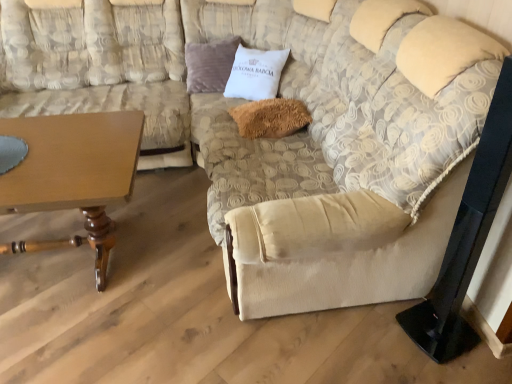
What do you see at coordinates (100, 66) in the screenshot? This screenshot has width=512, height=384. I see `beige fabric couch at left` at bounding box center [100, 66].

Where is `velvet purple pillow at upper center, arranged as the second pillow when ordered from the bottom`? Image resolution: width=512 pixels, height=384 pixels. velvet purple pillow at upper center, arranged as the second pillow when ordered from the bottom is located at coordinates (210, 64).

Locate an element on the screen. The height and width of the screenshot is (384, 512). beige fabric couch at left is located at coordinates (100, 66).

Which of these two, fuzzy brown pillow at center, the second pillow viewed from the top, or beige fabric couch at left, is wider?

Wider between the two is beige fabric couch at left.

Which of these two, fuzzy brown pillow at center, placed as the 1th pillow when sorted from front to back, or beige fabric couch at left, stands shorter?

With less height is fuzzy brown pillow at center, placed as the 1th pillow when sorted from front to back.

What's the angular difference between fuzzy brown pillow at center, which is counted as the second pillow, starting from the back, and beige fabric couch at left's facing directions?

88.8 degrees.

Considering the points (302, 119) and (24, 18), which point is behind, point (302, 119) or point (24, 18)?

Point (24, 18)

Would you say wooden table at lower left is inside or outside fuzzy brown pillow at center, placed as the 1th pillow when sorted from front to back?

wooden table at lower left cannot be found inside fuzzy brown pillow at center, placed as the 1th pillow when sorted from front to back.

What's the angular difference between wooden table at lower left and fuzzy brown pillow at center, which is counted as the second pillow, starting from the back,'s facing directions?

87.1 degrees separate the facing orientations of wooden table at lower left and fuzzy brown pillow at center, which is counted as the second pillow, starting from the back.

In the scene shown: Is wooden table at lower left wider than fuzzy brown pillow at center, which is the first pillow in right-to-left order?

Yes, wooden table at lower left is wider than fuzzy brown pillow at center, which is the first pillow in right-to-left order.

Looking at this image, considering the relative sizes of wooden table at lower left and fuzzy brown pillow at center, which is counted as the second pillow, starting from the back, in the image provided, is wooden table at lower left bigger than fuzzy brown pillow at center, which is counted as the second pillow, starting from the back,?

Yes.

From the image's perspective, relative to beige fabric couch at left, is velvet purple pillow at upper center, arranged as the second pillow when ordered from the bottom, above or below?

velvet purple pillow at upper center, arranged as the second pillow when ordered from the bottom, is situated higher than beige fabric couch at left in the image.

Which of these two, velvet purple pillow at upper center, the first pillow from the left, or beige fabric couch at left, is thinner?

velvet purple pillow at upper center, the first pillow from the left.

Who is shorter, velvet purple pillow at upper center, which is the first pillow from top to bottom, or beige fabric couch at left?

velvet purple pillow at upper center, which is the first pillow from top to bottom.

Is beige fabric couch at left to the right of fuzzy brown pillow at center, the 2th pillow viewed from the left, from the viewer's perspective?

No, beige fabric couch at left is not to the right of fuzzy brown pillow at center, the 2th pillow viewed from the left.

From a real-world perspective, who is located higher, beige fabric couch at left or fuzzy brown pillow at center, which is counted as the second pillow, starting from the back?

beige fabric couch at left.

How many degrees apart are the facing directions of beige fabric couch at left and fuzzy brown pillow at center, which is the first pillow in right-to-left order?

The facing directions of beige fabric couch at left and fuzzy brown pillow at center, which is the first pillow in right-to-left order, are 88.8 degrees apart.

Consider the image. Is the depth of beige fabric couch at left less than that of fuzzy brown pillow at center, which is the first pillow in right-to-left order?

Yes, beige fabric couch at left is in front of fuzzy brown pillow at center, which is the first pillow in right-to-left order.

From the image's perspective, would you say velvet purple pillow at upper center, which ranks as the 2th pillow in front-to-back order, is positioned over fuzzy brown pillow at center, which ranks as the 1th pillow in bottom-to-top order?

Indeed, from the image's perspective, velvet purple pillow at upper center, which ranks as the 2th pillow in front-to-back order, is shown above fuzzy brown pillow at center, which ranks as the 1th pillow in bottom-to-top order.

Is velvet purple pillow at upper center, arranged as the second pillow when ordered from the bottom, located outside fuzzy brown pillow at center, the 2th pillow viewed from the left?

That's correct, velvet purple pillow at upper center, arranged as the second pillow when ordered from the bottom, is outside of fuzzy brown pillow at center, the 2th pillow viewed from the left.

Considering the points (214, 63) and (259, 114), which point is behind, point (214, 63) or point (259, 114)?

Positioned behind is point (214, 63).

Would you consider fuzzy brown pillow at center, which is counted as the second pillow, starting from the back, to be distant from wooden table at lower left?

No, there isn't a large distance between fuzzy brown pillow at center, which is counted as the second pillow, starting from the back, and wooden table at lower left.

From a real-world perspective, is fuzzy brown pillow at center, which ranks as the 1th pillow in bottom-to-top order, under wooden table at lower left?

No, from a real-world perspective, fuzzy brown pillow at center, which ranks as the 1th pillow in bottom-to-top order, is not beneath wooden table at lower left.

Based on their positions, is fuzzy brown pillow at center, which ranks as the 1th pillow in bottom-to-top order, located to the left or right of wooden table at lower left?

fuzzy brown pillow at center, which ranks as the 1th pillow in bottom-to-top order, is to the right of wooden table at lower left.

Where is `table below the fuzzy brown pillow at center, which ranks as the 1th pillow in bottom-to-top order (from the image's perspective)`? Image resolution: width=512 pixels, height=384 pixels. table below the fuzzy brown pillow at center, which ranks as the 1th pillow in bottom-to-top order (from the image's perspective) is located at coordinates (73, 174).

From the image's perspective, is velvet purple pillow at upper center, which is the 1th pillow from back to front, over wooden table at lower left?

Indeed, from the image's perspective, velvet purple pillow at upper center, which is the 1th pillow from back to front, is shown above wooden table at lower left.

Considering the relative sizes of velvet purple pillow at upper center, which ranks as the 2th pillow in front-to-back order, and wooden table at lower left in the image provided, is velvet purple pillow at upper center, which ranks as the 2th pillow in front-to-back order, taller than wooden table at lower left?

In fact, velvet purple pillow at upper center, which ranks as the 2th pillow in front-to-back order, may be shorter than wooden table at lower left.

This screenshot has width=512, height=384. Find the location of `the 2nd pillow directly above the wooden table at lower left (from a real-world perspective)`. the 2nd pillow directly above the wooden table at lower left (from a real-world perspective) is located at coordinates (210, 64).

Which is correct: velvet purple pillow at upper center, the first pillow from the left, is inside wooden table at lower left, or outside of it?

The correct answer is: outside.

The height and width of the screenshot is (384, 512). Identify the location of couch lying on the left of fuzzy brown pillow at center, the 2th pillow viewed from the left. (100, 66).

What are the coordinates of `table that is under the fuzzy brown pillow at center, the second pillow viewed from the top (from a real-world perspective)` in the screenshot? It's located at (73, 174).

Based on their spatial positions, is velvet purple pillow at upper center, which ranks as the 2th pillow in front-to-back order, or fuzzy brown pillow at center, placed as the 1th pillow when sorted from front to back, closer to wooden table at lower left?

Based on the image, fuzzy brown pillow at center, placed as the 1th pillow when sorted from front to back, appears to be nearer to wooden table at lower left.

Consider the image. Looking at the image, which one is located closer to wooden table at lower left, fuzzy brown pillow at center, placed as the 1th pillow when sorted from front to back, or velvet purple pillow at upper center, which is the first pillow from top to bottom?

The object closer to wooden table at lower left is fuzzy brown pillow at center, placed as the 1th pillow when sorted from front to back.

Looking at the image, which one is located closer to velvet purple pillow at upper center, which is the 1th pillow from back to front, wooden table at lower left or beige fabric couch at left?

Based on the image, beige fabric couch at left appears to be nearer to velvet purple pillow at upper center, which is the 1th pillow from back to front.

Which object lies further to the anchor point beige fabric couch at left, velvet purple pillow at upper center, which is the 1th pillow from back to front, or wooden table at lower left?

wooden table at lower left is further to beige fabric couch at left.

When comparing their distances from velvet purple pillow at upper center, the first pillow from the left, does wooden table at lower left or fuzzy brown pillow at center, which ranks as the 1th pillow in bottom-to-top order, seem closer?

The object closer to velvet purple pillow at upper center, the first pillow from the left, is fuzzy brown pillow at center, which ranks as the 1th pillow in bottom-to-top order.

When comparing their distances from fuzzy brown pillow at center, which ranks as the 1th pillow in bottom-to-top order, does velvet purple pillow at upper center, which is the first pillow from top to bottom, or wooden table at lower left seem closer?

velvet purple pillow at upper center, which is the first pillow from top to bottom, is closer to fuzzy brown pillow at center, which ranks as the 1th pillow in bottom-to-top order.

Based on their spatial positions, is beige fabric couch at left or velvet purple pillow at upper center, arranged as the second pillow when ordered from the bottom, closer to wooden table at lower left?

beige fabric couch at left is closer to wooden table at lower left.

Considering their positions, is fuzzy brown pillow at center, which ranks as the 1th pillow in bottom-to-top order, positioned closer to velvet purple pillow at upper center, which is the 1th pillow from back to front, than beige fabric couch at left?

Among the two, beige fabric couch at left is located nearer to velvet purple pillow at upper center, which is the 1th pillow from back to front.

Where is `pillow located between beige fabric couch at left and fuzzy brown pillow at center, placed as the 1th pillow when sorted from front to back, in the left-right direction`? The image size is (512, 384). pillow located between beige fabric couch at left and fuzzy brown pillow at center, placed as the 1th pillow when sorted from front to back, in the left-right direction is located at coordinates (210, 64).

Where is `pillow between wooden table at lower left and velvet purple pillow at upper center, which is the first pillow from top to bottom, along the z-axis`? pillow between wooden table at lower left and velvet purple pillow at upper center, which is the first pillow from top to bottom, along the z-axis is located at coordinates (271, 118).

Locate an element on the screen. couch between wooden table at lower left and velvet purple pillow at upper center, which ranks as the second pillow in right-to-left order, in the front-back direction is located at coordinates (x=100, y=66).

The height and width of the screenshot is (384, 512). In order to click on table between beige fabric couch at left and fuzzy brown pillow at center, which is counted as the second pillow, starting from the back, from left to right in this screenshot , I will do `click(73, 174)`.